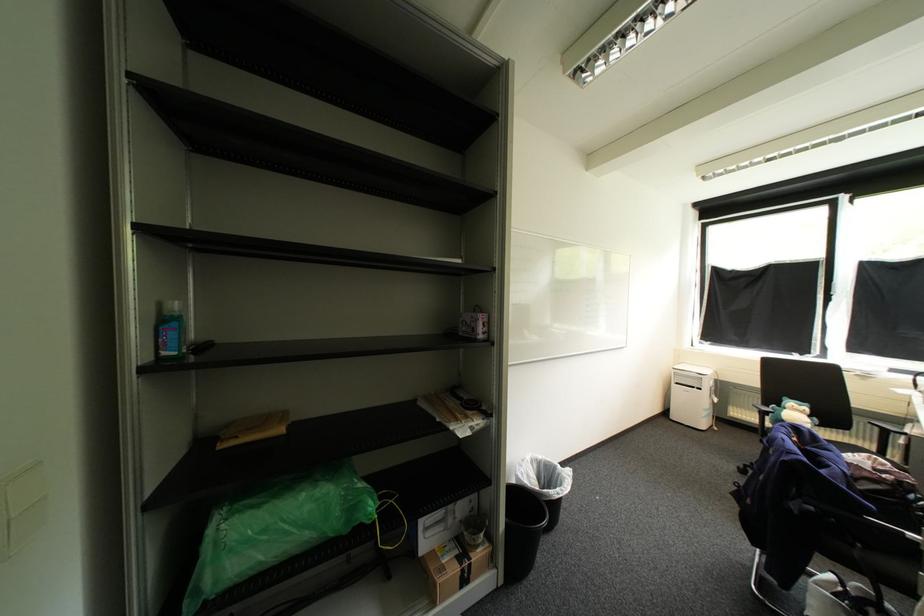
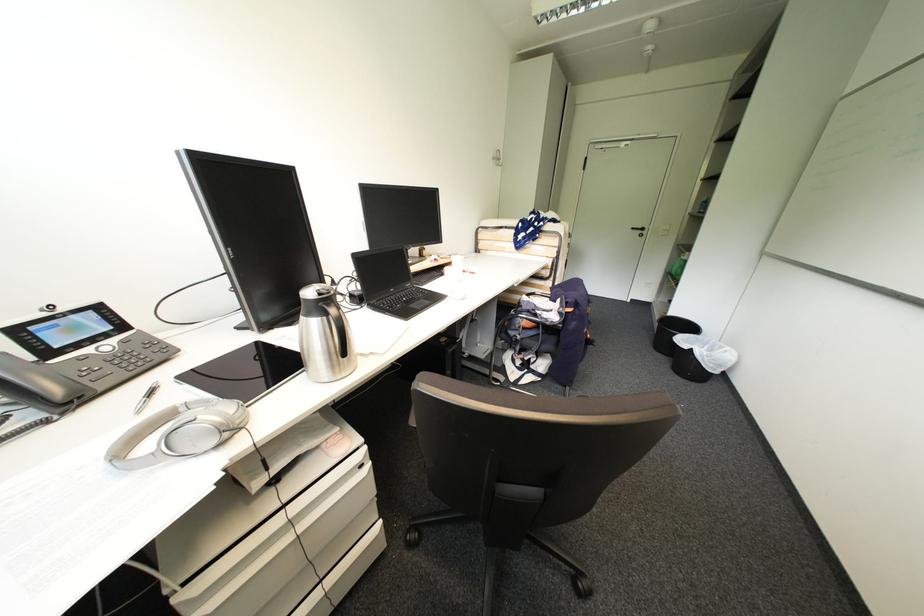
Question: I am providing you with two images of the same scene from different viewpoints. After the viewpoint changes to image2, which objects are now occluded?

Choices:
 (A) small cardboard box
 (B) white door handle
 (C) small white booklet
 (D) thermos lid button

Answer: (A)